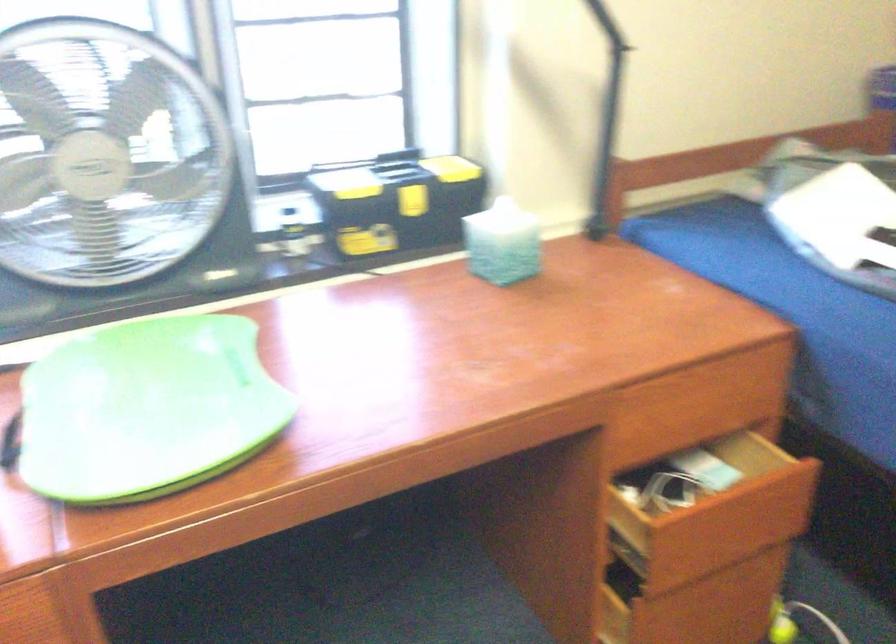
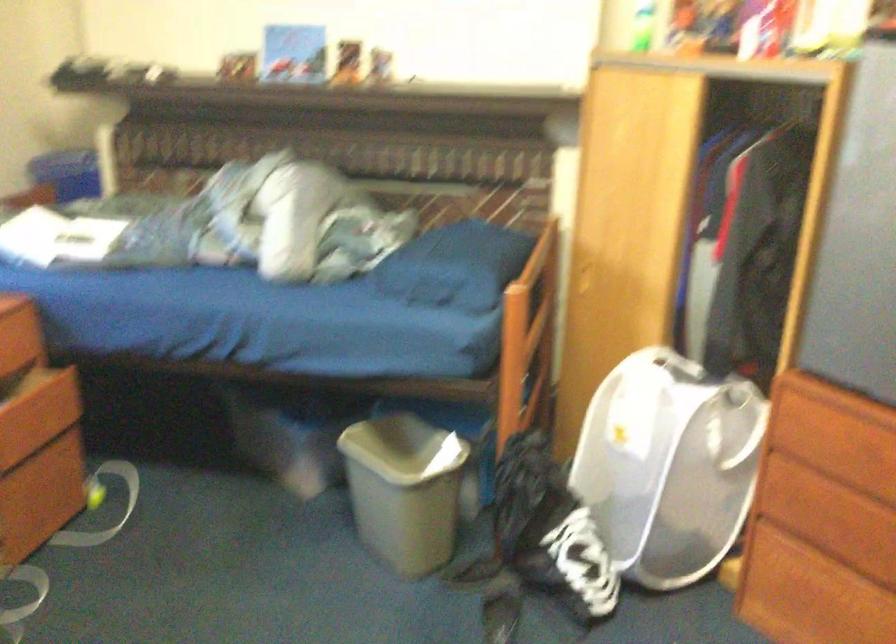
In the second image, find the point that corresponds to pixel 751 389 in the first image.

(19, 332)